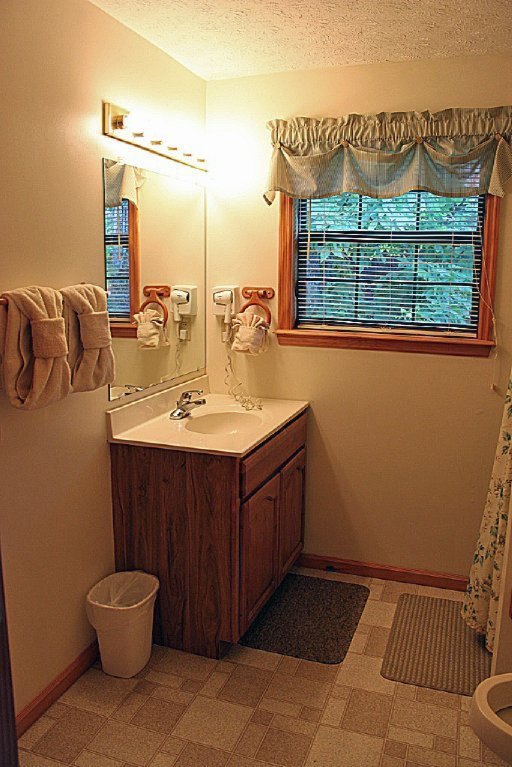
This screenshot has width=512, height=767. In order to click on towel holder in this screenshot , I will do `click(255, 295)`.